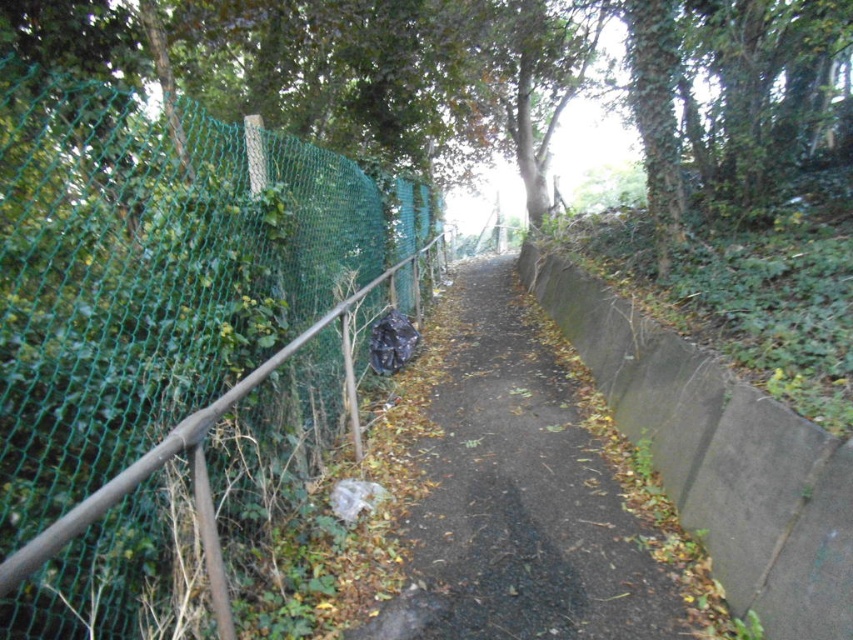
Is black asphalt path at center closer to the viewer compared to brown metal/rusty rail at left?

No, black asphalt path at center is further to the viewer.

Does point (456, 371) come in front of point (233, 387)?

No, (456, 371) is behind (233, 387).

Is point (579, 449) closer to viewer compared to point (148, 468)?

No, (579, 449) is further to viewer.

Locate an element on the screen. This screenshot has width=853, height=640. black asphalt path at center is located at coordinates (527, 497).